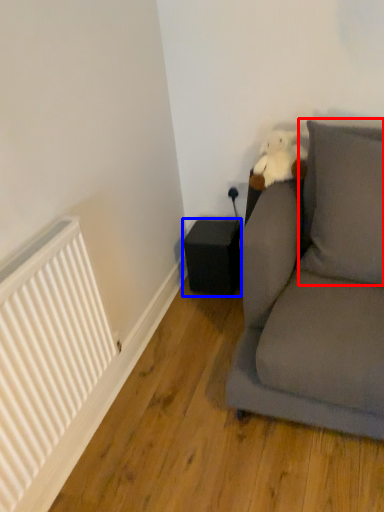
Question: Which of the following is the farthest to the observer, pillow (highlighted by a red box) or speaker (highlighted by a blue box)?

Choices:
 (A) pillow
 (B) speaker

Answer: (B)